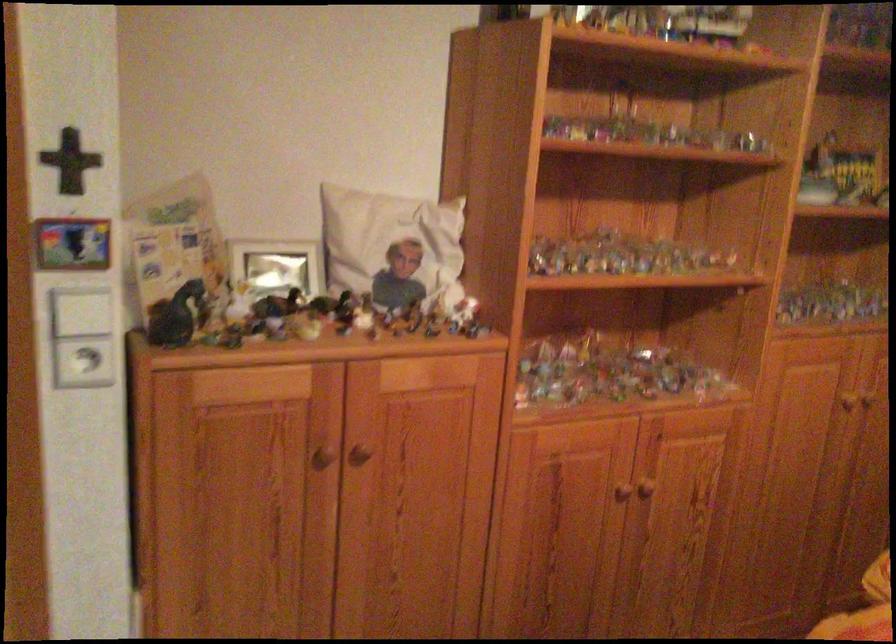
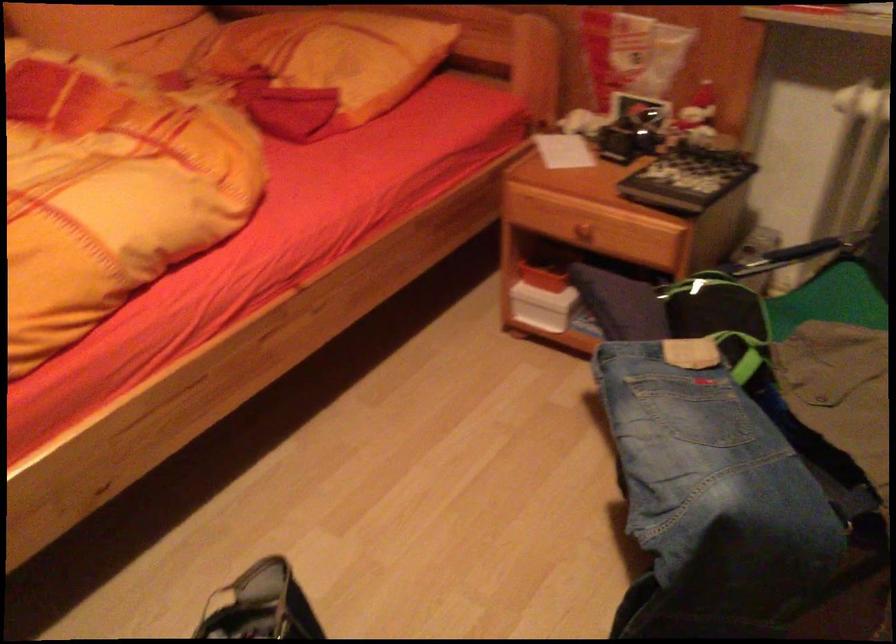
How did the camera likely rotate?

The camera's rotation is toward right-down.